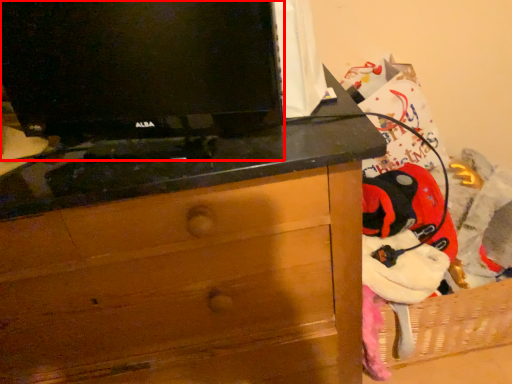
Question: From the image, what is the correct spatial relationship of television (annotated by the red box) in relation to chest of drawers?

Choices:
 (A) left
 (B) right

Answer: (B)